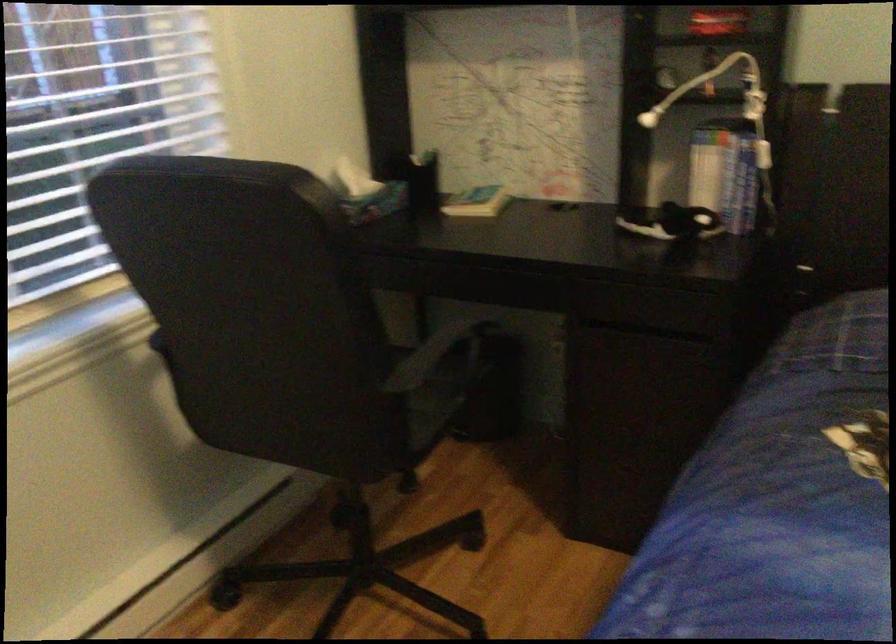
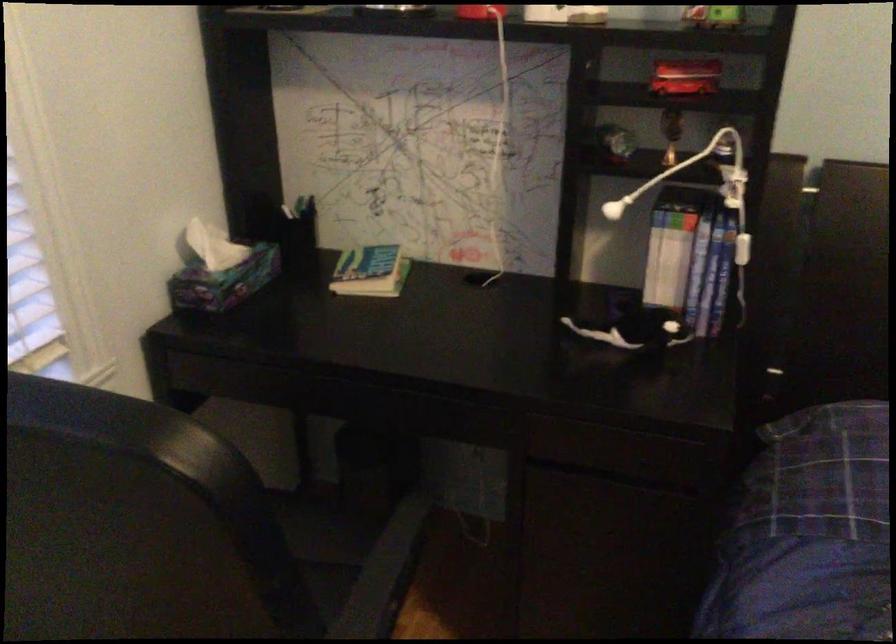
Question: Based on the continuous images, in which direction is the camera rotating? Reply with the corresponding letter.

Choices:
 (A) Left
 (B) Right
 (C) Up
 (D) Down

Answer: (B)